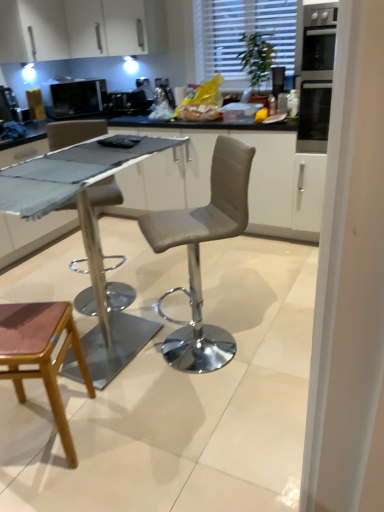
Question: Is pink leather stool at lower left to the left or to the right of black glass oven at upper right in the image?

Choices:
 (A) left
 (B) right

Answer: (A)

Question: Looking at their shapes, would you say pink leather stool at lower left is wider or thinner than black glass oven at upper right?

Choices:
 (A) wide
 (B) thin

Answer: (B)

Question: Estimate the real-world distances between objects in this image. Which object is farther from the white textured blinds at upper center?

Choices:
 (A) dark gray fabric-covered table at center
 (B) white glossy cabinet at upper left
 (C) matte black microwave at upper left, placed as the second appliance when sorted from right to left
 (D) pink leather stool at lower left
 (E) black glass oven at upper right

Answer: (D)

Question: Based on their relative distances, which object is farther from the matte black microwave at upper left, placed as the second appliance when sorted from right to left?

Choices:
 (A) satin black coffee machine at center, the 2th appliance positioned from the left
 (B) pink leather stool at lower left
 (C) dark gray fabric-covered table at center
 (D) white glossy cabinet at upper left
 (E) black glass oven at upper right

Answer: (B)